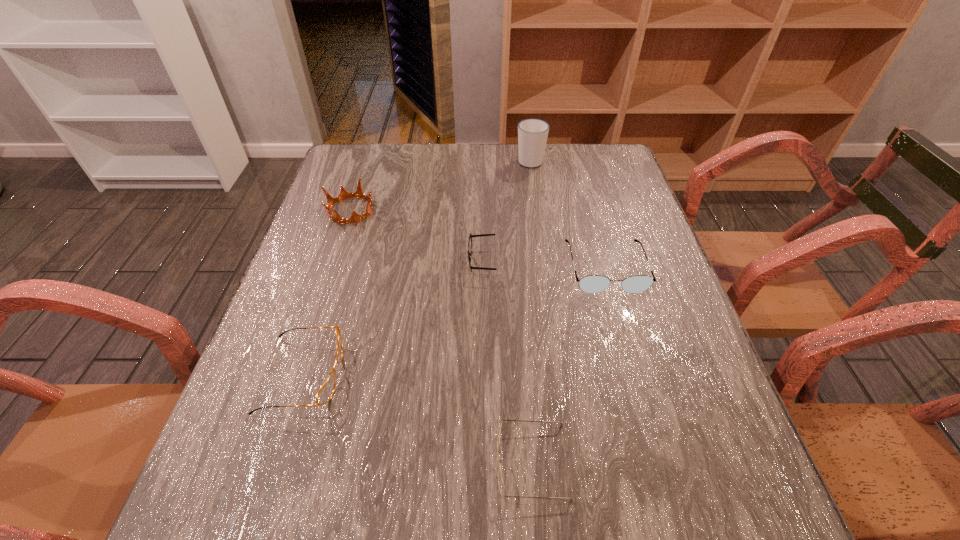
Identify the location of vacant space that is in between the nearest spectacles and the farthest object. (531, 312).

Identify which object is the nearest to the crown. Please provide its 2D coordinates. Your answer should be formatted as a tuple, i.e. [(x, y)], where the tuple contains the x and y coordinates of a point satisfying the conditions above.

[(470, 243)]

I want to click on object that is the fourth closest one to the rightmost spectacles, so click(325, 393).

Identify which spectacles is the nearest to the nearest spectacles. Please provide its 2D coordinates. Your answer should be formatted as a tuple, i.e. [(x, y)], where the tuple contains the x and y coordinates of a point satisfying the conditions above.

[(325, 393)]

Identify the location of spectacles that is the third closest to the second farthest object. [592, 284].